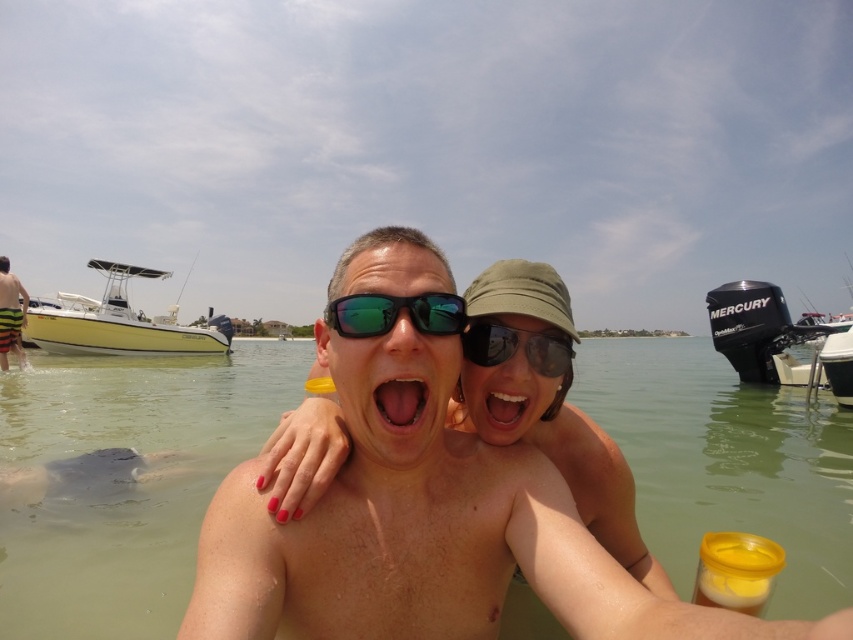
Looking at this image, between clear water at center and black metallic motorboat at right, which one has more height?

black metallic motorboat at right is taller.

Which is in front, point (584, 378) or point (747, 284)?

Positioned in front is point (747, 284).

You are a GUI agent. You are given a task and a screenshot of the screen. Output one action in this format:
    pyautogui.click(x=<x>, y=<y>)
    Task: Click on the clear water at center
    
    Given the screenshot: What is the action you would take?
    pyautogui.click(x=125, y=481)

Does clear water at center come in front of shiny black sunglasses at center?

No, it is not.

Does clear water at center appear on the right side of shiny black sunglasses at center?

In fact, clear water at center is to the left of shiny black sunglasses at center.

The height and width of the screenshot is (640, 853). Identify the location of clear water at center. (125, 481).

Does shiny black sunglasses at center have a larger size compared to bright white teeth at center?

Yes, shiny black sunglasses at center is bigger than bright white teeth at center.

Between point (550, 369) and point (509, 429), which one is positioned behind?

Point (550, 369)

You are a GUI agent. You are given a task and a screenshot of the screen. Output one action in this format:
    pyautogui.click(x=<x>, y=<y>)
    Task: Click on the shiny black sunglasses at center
    Image resolution: width=853 pixels, height=640 pixels.
    Given the screenshot: What is the action you would take?
    pyautogui.click(x=515, y=346)